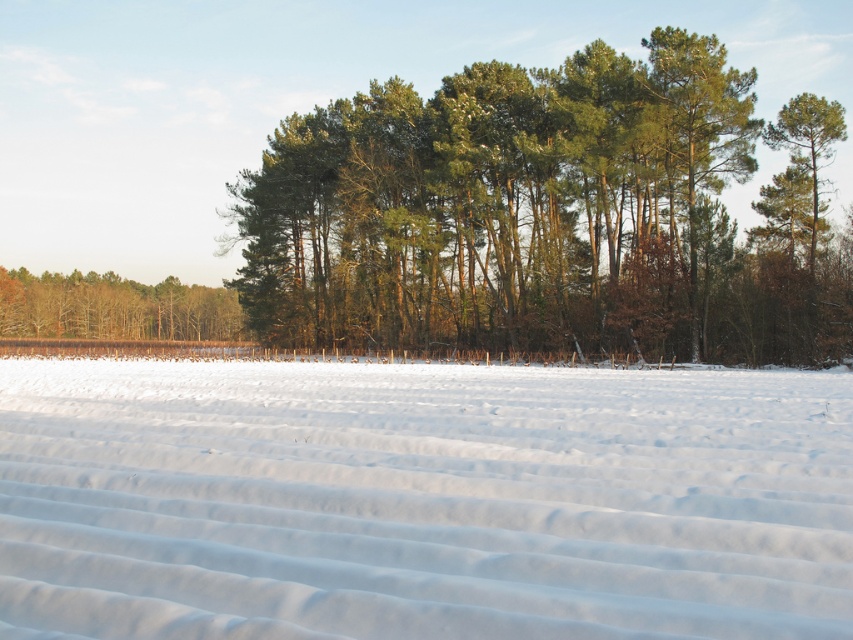
Question: Which point appears farthest from the camera in this image?

Choices:
 (A) (848, 436)
 (B) (244, 237)
 (C) (143, 285)

Answer: (C)

Question: Which point appears farthest from the camera in this image?

Choices:
 (A) (51, 326)
 (B) (314, 273)
 (C) (538, 449)

Answer: (A)

Question: Is green textured trees at center to the right of brown matte trees at left from the viewer's perspective?

Choices:
 (A) no
 (B) yes

Answer: (B)

Question: Can you confirm if white smooth snow at center is bigger than brown matte trees at left?

Choices:
 (A) no
 (B) yes

Answer: (A)

Question: Which point is farther to the camera?

Choices:
 (A) (346, 321)
 (B) (44, 300)
 (C) (289, 440)

Answer: (B)

Question: Can you confirm if white smooth snow at center is thinner than brown matte trees at left?

Choices:
 (A) yes
 (B) no

Answer: (A)